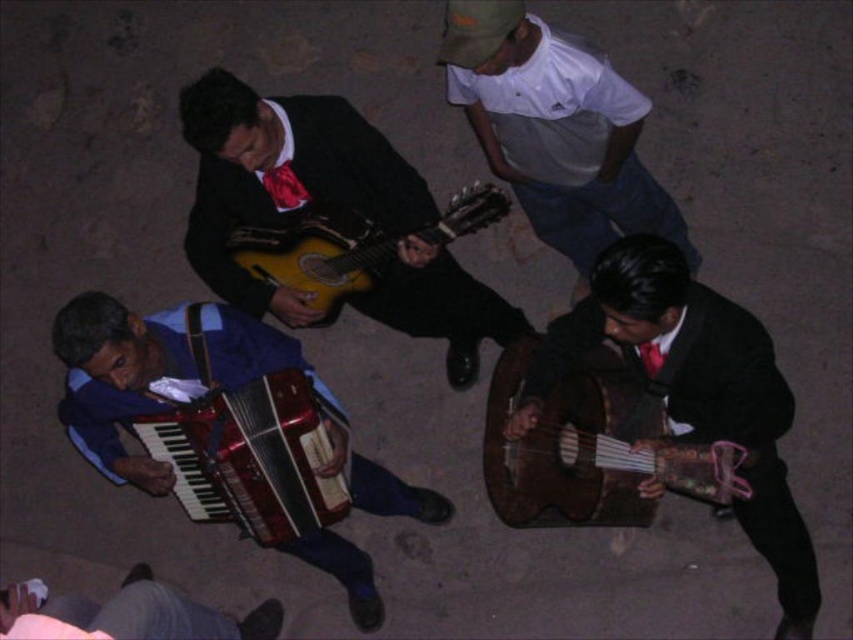
Between metallic blue accordion at lower left and metallic red accordion at lower left, which one appears on the left side from the viewer's perspective?

metallic blue accordion at lower left is more to the left.

Between point (376, 500) and point (277, 417), which one is positioned behind?

The point (376, 500) is behind.

What are the coordinates of `metallic blue accordion at lower left` in the screenshot? It's located at (119, 380).

Who is higher up, shiny brown guitar at right or matte red tie at upper center?

Positioned higher is matte red tie at upper center.

Does shiny brown guitar at right come behind matte red tie at upper center?

No, shiny brown guitar at right is closer to the viewer.

Between point (792, 573) and point (283, 198), which one is positioned behind?

Point (283, 198)

Identify the location of shiny brown guitar at right. (694, 392).

Does wooden acoustic guitar at lower right have a greater height compared to metallic red accordion at lower left?

Incorrect, wooden acoustic guitar at lower right's height is not larger of metallic red accordion at lower left's.

Is point (601, 456) farther from camera compared to point (265, 448)?

No, (601, 456) is in front of (265, 448).

Is point (567, 509) farther from viewer compared to point (334, 513)?

No, (567, 509) is in front of (334, 513).

Identify the location of wooden acoustic guitar at lower right. click(592, 448).